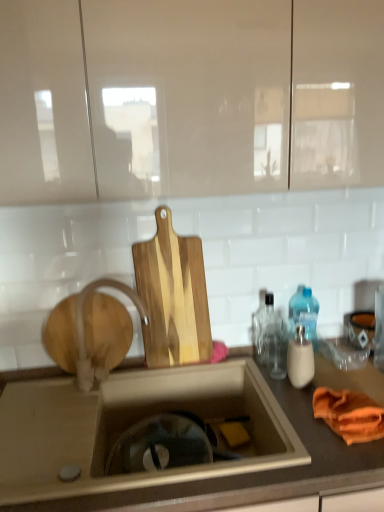
Locate an element on the screen. empty space that is in between translucent glass bottle at right, positioned as the third bottle in back-to-front order, and orange cloth at right is located at coordinates (312, 392).